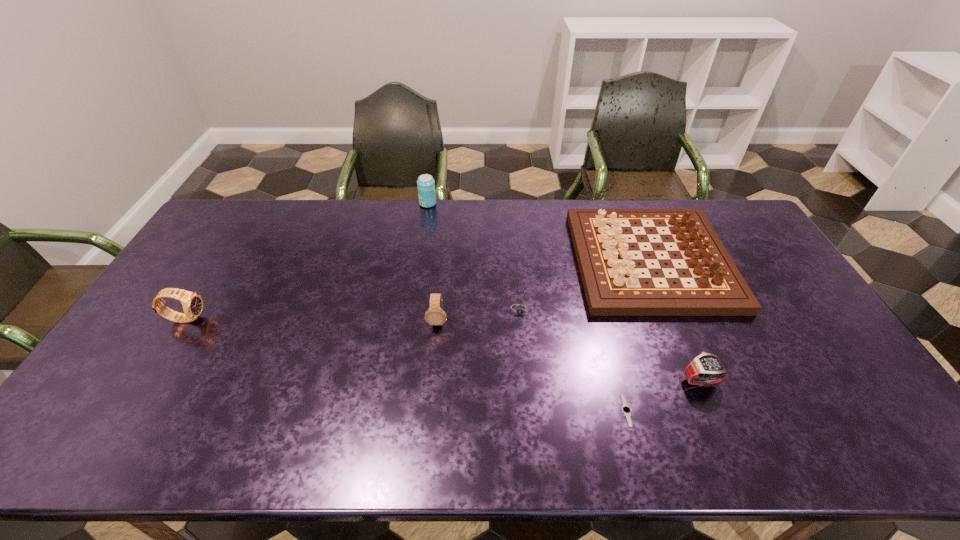
The image size is (960, 540). Find the location of `free space between the fourth object from left to right and the fifth object from right to left`. free space between the fourth object from left to right and the fifth object from right to left is located at coordinates (479, 315).

Locate an element on the screen. The height and width of the screenshot is (540, 960). empty space between the leftmost watch and the second watch from left to right is located at coordinates (312, 320).

At what (x,y) coordinates should I click in order to perform the action: click on free space between the third watch from right to left and the leftmost watch. Please return your answer as a coordinate pair (x, y). The height and width of the screenshot is (540, 960). Looking at the image, I should click on (353, 314).

Locate an element on the screen. free space between the beer can and the third tallest watch is located at coordinates (564, 292).

Where is `vacant space in between the gameboard and the fifth object from right to left`? Image resolution: width=960 pixels, height=540 pixels. vacant space in between the gameboard and the fifth object from right to left is located at coordinates (544, 291).

This screenshot has height=540, width=960. What are the coordinates of `free space between the nearest watch and the third watch from right to left` in the screenshot? It's located at 573,361.

Locate an element on the screen. This screenshot has width=960, height=540. free space between the gameboard and the third tallest watch is located at coordinates (675, 320).

Find the location of a particular element. This screenshot has height=540, width=960. the sixth closest object to the second watch from left to right is located at coordinates (192, 303).

Where is `object that can be found as the third closest to the gameboard`? object that can be found as the third closest to the gameboard is located at coordinates (626, 410).

Locate which watch is the fourth closest to the nearest object. Please provide its 2D coordinates. Your answer should be formatted as a tuple, i.e. [(x, y)], where the tuple contains the x and y coordinates of a point satisfying the conditions above.

[(192, 303)]